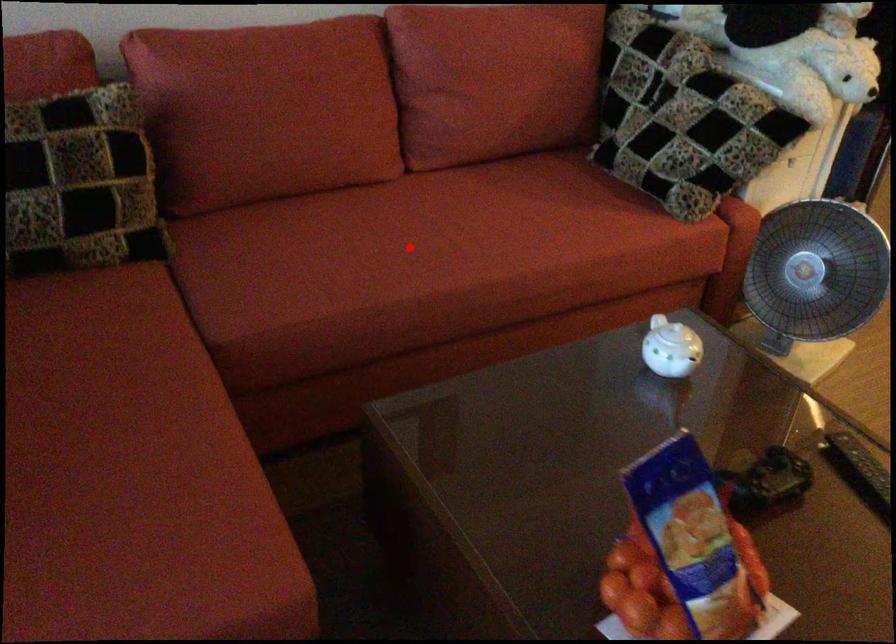
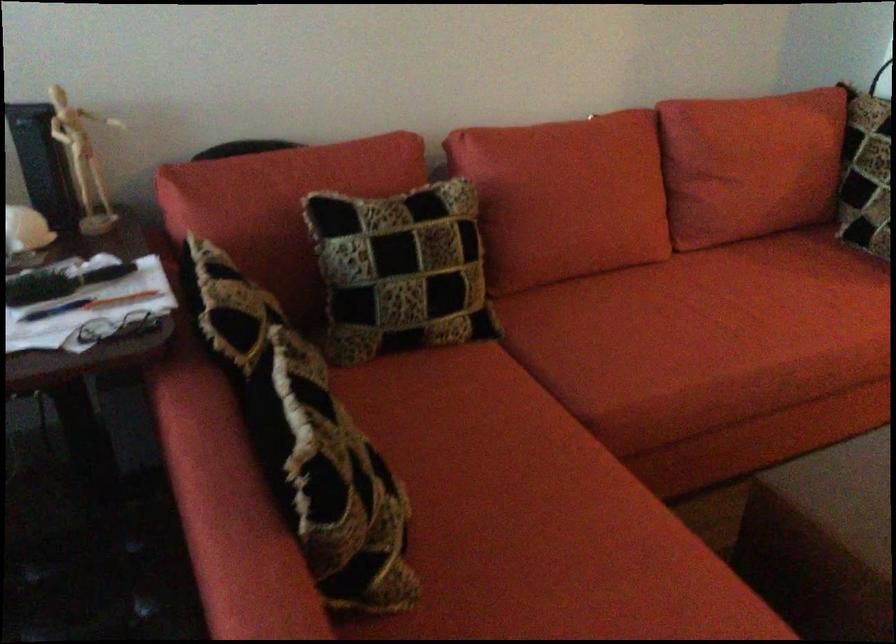
In the second image, find the point that corresponds to the highlighted location in the first image.

(726, 323)